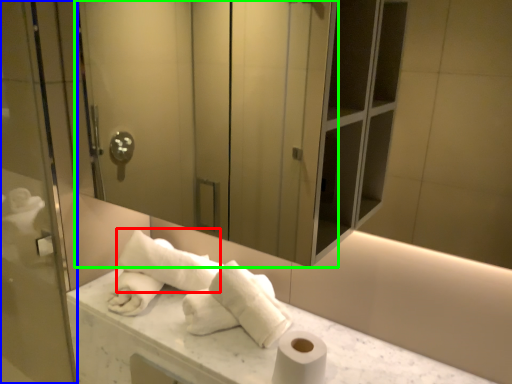
Question: Which object is the closest to the bath towel (highlighted by a red box)? Choose among these: screen door (highlighted by a blue box) or screen door (highlighted by a green box).

Choices:
 (A) screen door
 (B) screen door

Answer: (A)